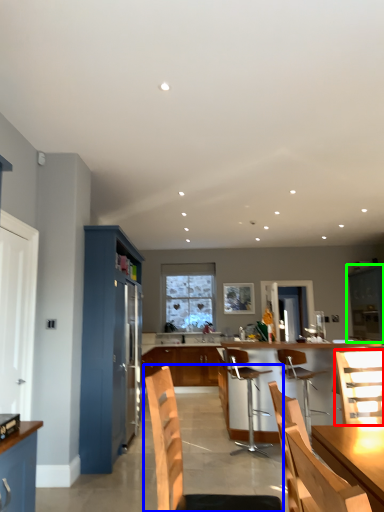
Question: Which is farther away from chair (highlighted by a red box)? chair (highlighted by a blue box) or cabinetry (highlighted by a green box)?

Choices:
 (A) chair
 (B) cabinetry

Answer: (B)